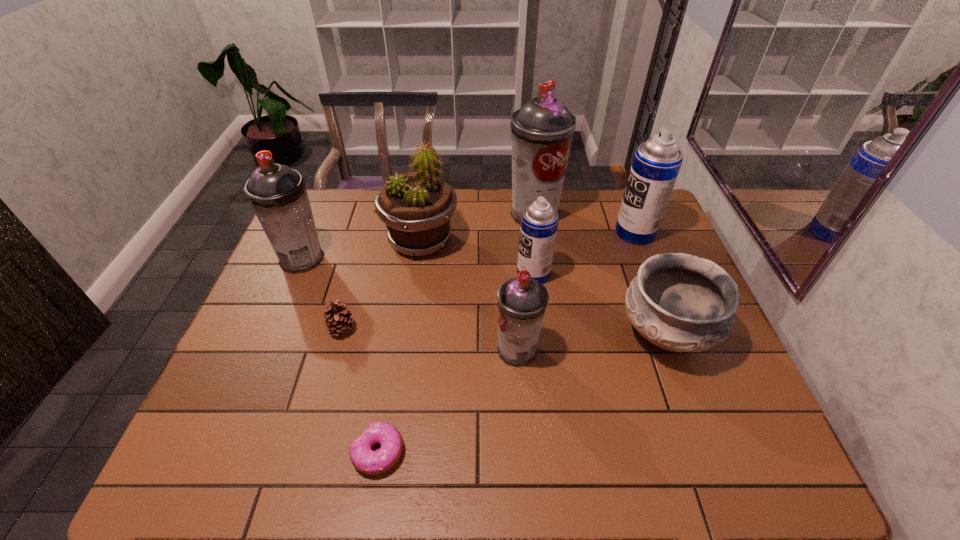
This screenshot has width=960, height=540. What are the coordinates of `the nearest gray aerosol can` in the screenshot? It's located at (522, 301).

Locate an element on the screen. the seventh tallest object is located at coordinates (680, 302).

Find the location of a particular element. the eighth tallest object is located at coordinates (337, 319).

The image size is (960, 540). Identify the location of pinecone. (337, 319).

The image size is (960, 540). In order to click on the nearest object in this screenshot , I will do `click(363, 458)`.

You are a GUI agent. You are given a task and a screenshot of the screen. Output one action in this format:
    pyautogui.click(x=<x>, y=<y>)
    Task: Click on the pink doughnut
    
    Given the screenshot: What is the action you would take?
    pyautogui.click(x=363, y=458)

Find the location of a particular element. free space located 0.270m on the left of the tallest object is located at coordinates (428, 214).

This screenshot has width=960, height=540. Find the location of `vacant space located 0.260m on the label side of the right blue aerosol can`. vacant space located 0.260m on the label side of the right blue aerosol can is located at coordinates (536, 232).

Where is `free spot located 0.260m on the label side of the right blue aerosol can`? This screenshot has height=540, width=960. free spot located 0.260m on the label side of the right blue aerosol can is located at coordinates (536, 232).

Locate an element on the screen. vacant space located on the label side of the right blue aerosol can is located at coordinates (527, 232).